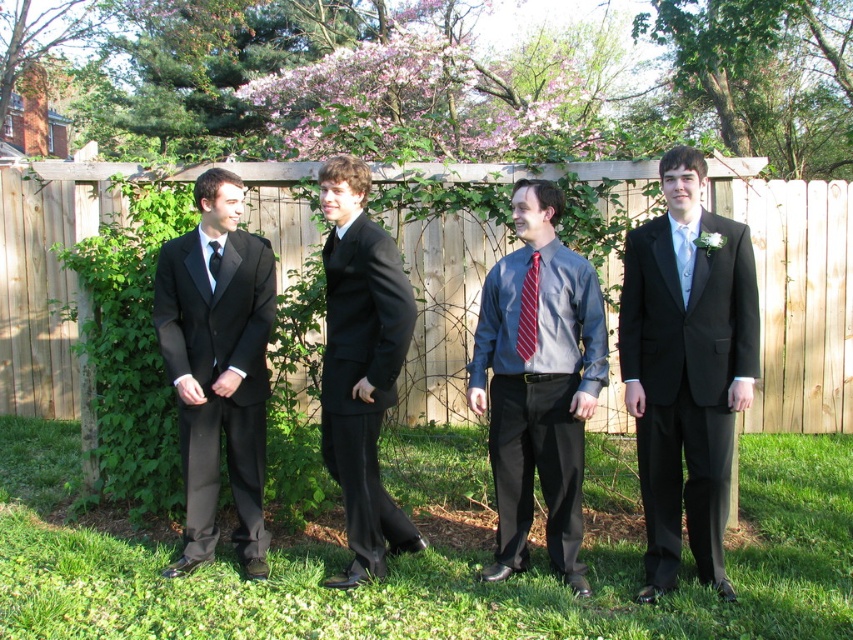
Between green grass at lower center and matte gray shirt at center, which one has more height?

matte gray shirt at center is taller.

Does green grass at lower center have a greater width compared to matte gray shirt at center?

Yes.

Where is `green grass at lower center`? The image size is (853, 640). green grass at lower center is located at coordinates (425, 566).

Does point (746, 548) come in front of point (242, 349)?

No, (746, 548) is further to viewer.

Does green grass at lower center have a larger size compared to matte black suit at left?

No, green grass at lower center is not bigger than matte black suit at left.

Which is behind, point (6, 586) or point (207, 180)?

The point (207, 180) is more distant.

The width and height of the screenshot is (853, 640). What are the coordinates of `green grass at lower center` in the screenshot? It's located at (425, 566).

Who is higher up, green grass at lower center or matte black tie at left?

Positioned higher is matte black tie at left.

I want to click on green grass at lower center, so click(425, 566).

Identify the location of green grass at lower center. The image size is (853, 640). (425, 566).